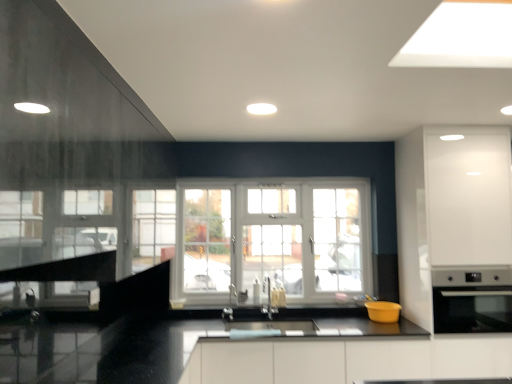
What do you see at coordinates (269, 298) in the screenshot?
I see `satin nickel faucet at center, which is the second faucet from left to right` at bounding box center [269, 298].

Locate an element on the screen. The image size is (512, 384). black glossy countertop at center is located at coordinates point(290,353).

Describe the element at coordinates (207, 234) in the screenshot. The height and width of the screenshot is (384, 512). I see `white plastic window at center` at that location.

Locate an element on the screen. This screenshot has height=384, width=512. satin silver oven at right, positioned as the 1th appliance in right-to-left order is located at coordinates (472, 299).

Starting from the satin nickel faucet at center, placed as the 1th faucet when sorted from left to right, which appliance is the 1st one in front? Please provide its 2D coordinates.

[(383, 311)]

What's the angular difference between yellow matte bowl at lower center, the first appliance when ordered from left to right, and satin nickel faucet at center, placed as the 1th faucet when sorted from left to right,'s facing directions?

2.19 degrees separate the facing orientations of yellow matte bowl at lower center, the first appliance when ordered from left to right, and satin nickel faucet at center, placed as the 1th faucet when sorted from left to right.

Is yellow matte bowl at lower center, the first appliance when ordered from left to right, bigger than satin nickel faucet at center, which appears as the second faucet when viewed from the right?

Yes, yellow matte bowl at lower center, the first appliance when ordered from left to right, is bigger than satin nickel faucet at center, which appears as the second faucet when viewed from the right.

From the image's perspective, relative to satin nickel faucet at center, which appears as the second faucet when viewed from the right, is yellow matte bowl at lower center, which ranks as the 2th appliance in right-to-left order, above or below?

yellow matte bowl at lower center, which ranks as the 2th appliance in right-to-left order, is situated lower than satin nickel faucet at center, which appears as the second faucet when viewed from the right, in the image.

Measure the distance between satin nickel faucet at center, placed as the 1th faucet when sorted from left to right, and satin nickel faucet at center, which is the first faucet in right-to-left order.

They are 11.90 inches apart.

From a real-world perspective, is satin nickel faucet at center, which appears as the second faucet when viewed from the right, positioned under satin nickel faucet at center, which is the second faucet from left to right, based on gravity?

Yes.

Does satin nickel faucet at center, placed as the 1th faucet when sorted from left to right, touch satin nickel faucet at center, which is the second faucet from left to right?

No, satin nickel faucet at center, placed as the 1th faucet when sorted from left to right, is not beside satin nickel faucet at center, which is the second faucet from left to right.

How many degrees apart are the facing directions of satin nickel faucet at center, which appears as the second faucet when viewed from the right, and satin nickel faucet at center, which is the second faucet from left to right?

The facing directions of satin nickel faucet at center, which appears as the second faucet when viewed from the right, and satin nickel faucet at center, which is the second faucet from left to right, are 0.000557 degrees apart.

Could you tell me if satin nickel faucet at center, which appears as the second faucet when viewed from the right, is facing yellow matte bowl at lower center, which ranks as the 2th appliance in right-to-left order?

No.

Which object is thinner, satin nickel faucet at center, placed as the 1th faucet when sorted from left to right, or yellow matte bowl at lower center, which ranks as the 2th appliance in right-to-left order?

Thinner between the two is satin nickel faucet at center, placed as the 1th faucet when sorted from left to right.

Find the location of `the 1st appliance in front of the satin nickel faucet at center, placed as the 1th faucet when sorted from left to right, counting from the anchor's position`. the 1st appliance in front of the satin nickel faucet at center, placed as the 1th faucet when sorted from left to right, counting from the anchor's position is located at coordinates (383, 311).

Is point (231, 305) closer or farther from the camera than point (393, 311)?

Clearly, point (231, 305) is more distant from the camera than point (393, 311).

Between point (337, 361) and point (500, 317), which one is positioned behind?

The point (500, 317) is behind.

Considering the sizes of black glossy countertop at center and satin silver oven at right, the second appliance viewed from the left, in the image, is black glossy countertop at center wider or thinner than satin silver oven at right, the second appliance viewed from the left,?

Considering their sizes, black glossy countertop at center looks slimmer than satin silver oven at right, the second appliance viewed from the left.

Find the location of a particular element. counter top below the satin silver oven at right, the second appliance viewed from the left (from the image's perspective) is located at coordinates (290, 353).

Is black glossy countertop at center facing towards satin silver oven at right, positioned as the 1th appliance in right-to-left order?

No, black glossy countertop at center is not aimed at satin silver oven at right, positioned as the 1th appliance in right-to-left order.

Image resolution: width=512 pixels, height=384 pixels. Identify the location of counter top in front of the satin nickel faucet at center, placed as the 1th faucet when sorted from left to right. (290, 353).

From a real-world perspective, is black glossy countertop at center on satin nickel faucet at center, which appears as the second faucet when viewed from the right?

No, from a real-world perspective, black glossy countertop at center is not over satin nickel faucet at center, which appears as the second faucet when viewed from the right

Does black glossy countertop at center have a greater width compared to satin nickel faucet at center, which appears as the second faucet when viewed from the right?

Correct, the width of black glossy countertop at center exceeds that of satin nickel faucet at center, which appears as the second faucet when viewed from the right.

From a real-world perspective, is black glossy countertop at center positioned above or below yellow matte bowl at lower center, which ranks as the 2th appliance in right-to-left order?

From a real-world perspective, black glossy countertop at center is physically below yellow matte bowl at lower center, which ranks as the 2th appliance in right-to-left order.

Who is bigger, black glossy countertop at center or yellow matte bowl at lower center, the first appliance when ordered from left to right?

black glossy countertop at center.

Which is more to the left, black glossy countertop at center or yellow matte bowl at lower center, the first appliance when ordered from left to right?

black glossy countertop at center is more to the left.

How different are the orientations of black glossy countertop at center and yellow matte bowl at lower center, which ranks as the 2th appliance in right-to-left order, in degrees?

black glossy countertop at center and yellow matte bowl at lower center, which ranks as the 2th appliance in right-to-left order, are facing 0.895 degrees away from each other.

Can you confirm if satin silver oven at right, positioned as the 1th appliance in right-to-left order, is shorter than black glossy countertop at center?

Yes, satin silver oven at right, positioned as the 1th appliance in right-to-left order, is shorter than black glossy countertop at center.

Considering the points (485, 268) and (349, 344), which point is behind, point (485, 268) or point (349, 344)?

Positioned behind is point (485, 268).

The height and width of the screenshot is (384, 512). Find the location of `the 1st appliance behind the black glossy countertop at center, counting from the anchor's position`. the 1st appliance behind the black glossy countertop at center, counting from the anchor's position is located at coordinates (472, 299).

In order to click on the 1st faucet above the yellow matte bowl at lower center, the first appliance when ordered from left to right (from the image's perspective) in this screenshot , I will do `click(230, 303)`.

Find the location of a particular element. Image resolution: width=512 pixels, height=384 pixels. faucet on the left of the satin nickel faucet at center, which is the first faucet in right-to-left order is located at coordinates [230, 303].

Looking at the image, which one is located further to yellow matte bowl at lower center, which ranks as the 2th appliance in right-to-left order, black glossy countertop at center or satin nickel faucet at center, which is the first faucet in right-to-left order?

The object further to yellow matte bowl at lower center, which ranks as the 2th appliance in right-to-left order, is satin nickel faucet at center, which is the first faucet in right-to-left order.

Estimate the real-world distances between objects in this image. Which object is further from satin silver oven at right, positioned as the 1th appliance in right-to-left order, satin nickel faucet at center, which appears as the second faucet when viewed from the right, or black glossy countertop at center?

satin nickel faucet at center, which appears as the second faucet when viewed from the right, lies further to satin silver oven at right, positioned as the 1th appliance in right-to-left order, than the other object.

Considering their positions, is black glossy countertop at center positioned closer to satin nickel faucet at center, which is the second faucet from left to right, than satin silver oven at right, the second appliance viewed from the left?

black glossy countertop at center.

Which object lies further to the anchor point satin silver oven at right, the second appliance viewed from the left, white plastic window at center or yellow matte bowl at lower center, the first appliance when ordered from left to right?

Among the two, white plastic window at center is located further to satin silver oven at right, the second appliance viewed from the left.

When comparing their distances from white plastic window at center, does satin silver oven at right, the second appliance viewed from the left, or satin nickel faucet at center, which is the first faucet in right-to-left order, seem further?

Among the two, satin silver oven at right, the second appliance viewed from the left, is located further to white plastic window at center.

Based on their spatial positions, is black glossy countertop at center or satin nickel faucet at center, placed as the 1th faucet when sorted from left to right, further from satin nickel faucet at center, which is the first faucet in right-to-left order?

black glossy countertop at center is positioned further to the anchor satin nickel faucet at center, which is the first faucet in right-to-left order.

Considering their positions, is white plastic window at center positioned closer to yellow matte bowl at lower center, which ranks as the 2th appliance in right-to-left order, than satin nickel faucet at center, which appears as the second faucet when viewed from the right?

white plastic window at center is positioned closer to the anchor yellow matte bowl at lower center, which ranks as the 2th appliance in right-to-left order.

Considering their positions, is yellow matte bowl at lower center, which ranks as the 2th appliance in right-to-left order, positioned closer to satin silver oven at right, positioned as the 1th appliance in right-to-left order, than satin nickel faucet at center, which is the first faucet in right-to-left order?

Based on the image, yellow matte bowl at lower center, which ranks as the 2th appliance in right-to-left order, appears to be nearer to satin silver oven at right, positioned as the 1th appliance in right-to-left order.

The image size is (512, 384). Identify the location of faucet between satin nickel faucet at center, placed as the 1th faucet when sorted from left to right, and satin silver oven at right, positioned as the 1th appliance in right-to-left order. (269, 298).

This screenshot has height=384, width=512. In order to click on window between satin nickel faucet at center, placed as the 1th faucet when sorted from left to right, and yellow matte bowl at lower center, which ranks as the 2th appliance in right-to-left order, from left to right in this screenshot , I will do `click(207, 234)`.

The width and height of the screenshot is (512, 384). I want to click on appliance located between satin nickel faucet at center, which is the first faucet in right-to-left order, and satin silver oven at right, the second appliance viewed from the left, in the left-right direction, so click(383, 311).

Where is `appliance situated between satin nickel faucet at center, placed as the 1th faucet when sorted from left to right, and satin silver oven at right, the second appliance viewed from the left, from left to right`? This screenshot has height=384, width=512. appliance situated between satin nickel faucet at center, placed as the 1th faucet when sorted from left to right, and satin silver oven at right, the second appliance viewed from the left, from left to right is located at coordinates (383, 311).